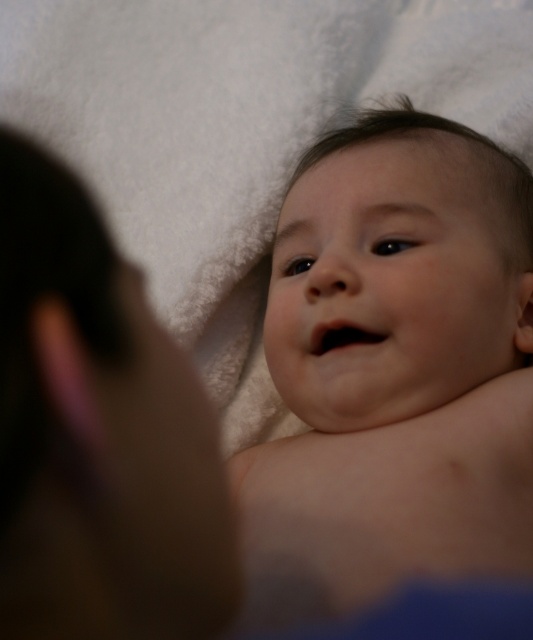
You are a photographer trying to capture a closeup of the baby. Since the smooth skin baby at center and brown skin at left are both in the frame, which one is positioned more to the right?

The smooth skin baby at center is positioned more to the right than the brown skin at left.